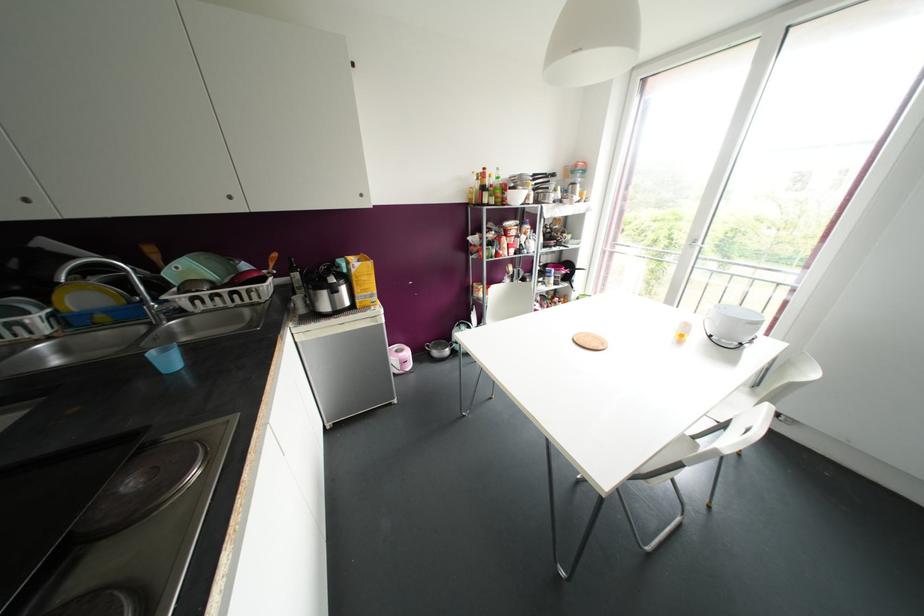
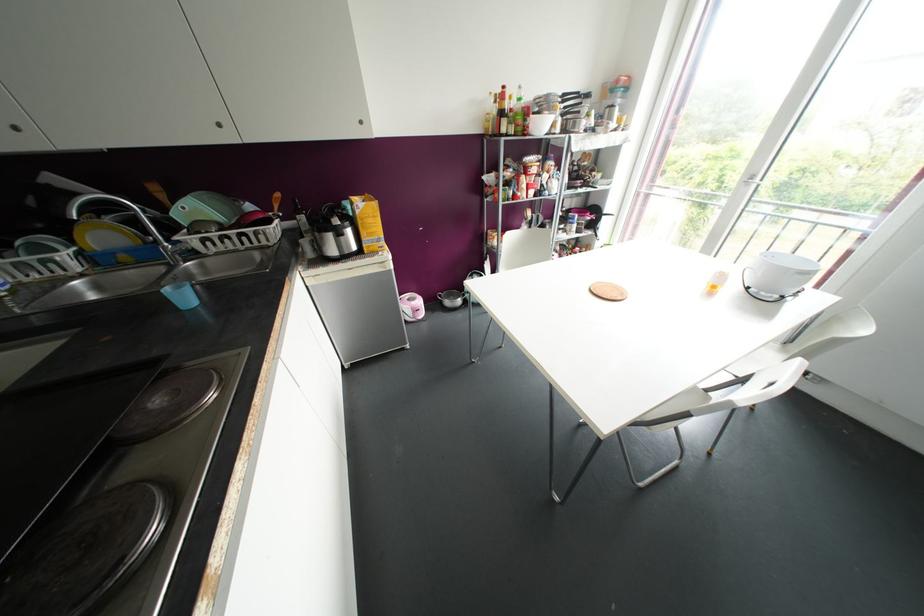
The point at (681, 334) is marked in the first image. Where is the corresponding point in the second image?

(713, 286)